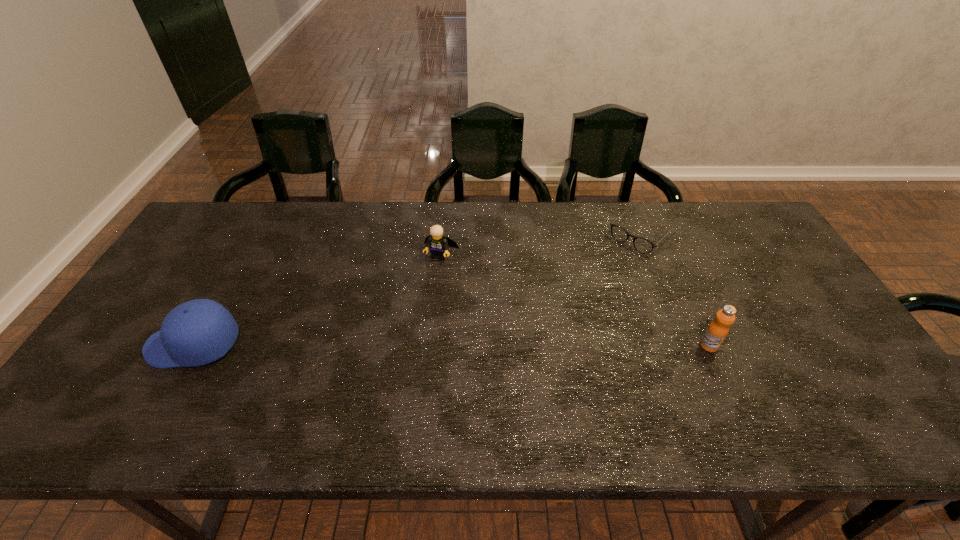
Identify the location of free space between the leftmost object and the Lego. (318, 300).

Image resolution: width=960 pixels, height=540 pixels. I want to click on empty location between the third object from right to left and the spectacles, so click(x=541, y=245).

The width and height of the screenshot is (960, 540). In order to click on vacant point located between the cap and the shortest object in this screenshot , I will do `click(418, 289)`.

Find the location of a particular element. object that can be found as the closest to the orange juice is located at coordinates (642, 245).

Choose which object is the nearest neighbor to the orange juice. Please provide its 2D coordinates. Your answer should be formatted as a tuple, i.e. [(x, y)], where the tuple contains the x and y coordinates of a point satisfying the conditions above.

[(642, 245)]

In order to click on free location that satisfies the following two spatial constraints: 1. on the back side of the shortest object; 2. on the right side of the third object from right to left in this screenshot , I will do `click(444, 234)`.